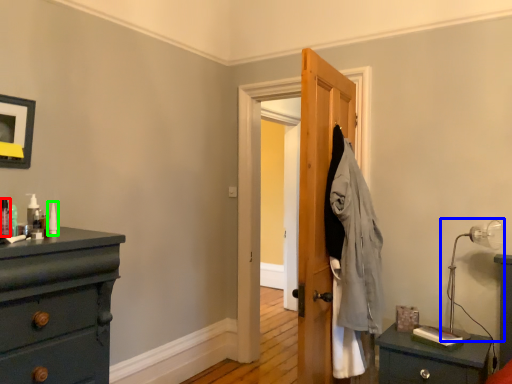
Question: Which object is positioned farthest from toiletry (highlighted by a red box)? Select from table lamp (highlighted by a blue box) and toiletry (highlighted by a green box).

Choices:
 (A) table lamp
 (B) toiletry

Answer: (A)